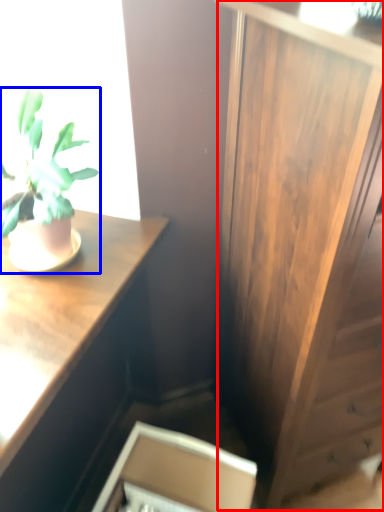
Question: Which object is further to the camera taking this photo, side cabinet (highlighted by a red box) or houseplant (highlighted by a blue box)?

Choices:
 (A) side cabinet
 (B) houseplant

Answer: (B)